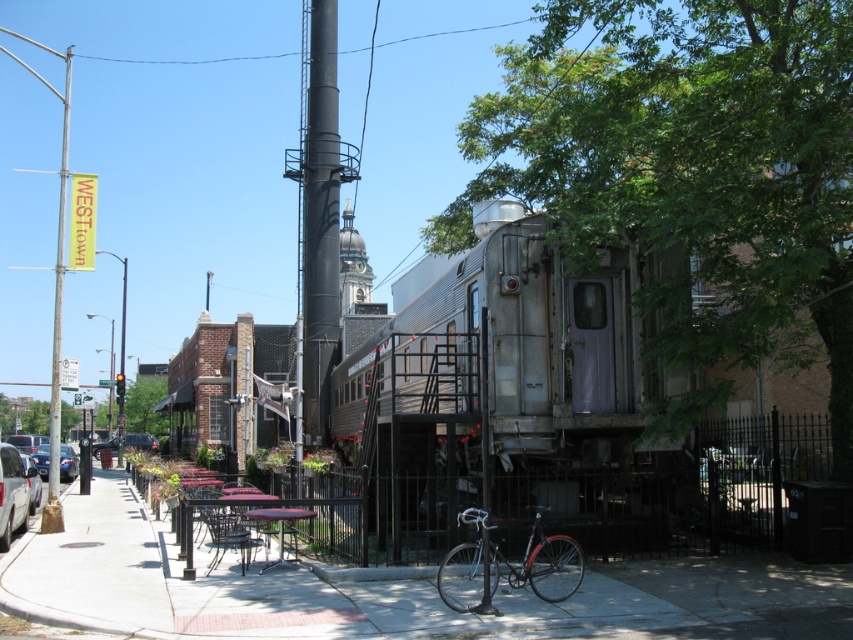
You are a delivery person who needs to load a package onto a cart that can only hold items shorter than the silver metallic car at left. Can the shiny silver bicycle at center be placed on the cart?

The shiny silver bicycle at center has a lesser height compared to the silver metallic car at left, so it can be placed on the cart since its height is shorter than the car.